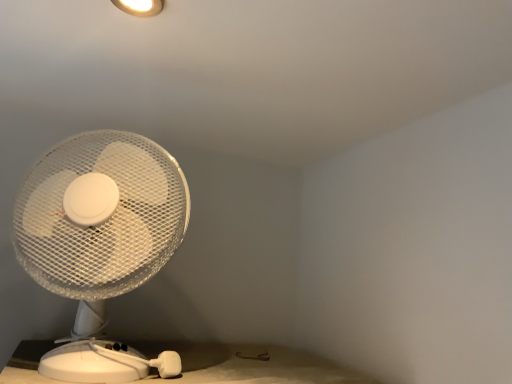
Describe the element at coordinates (100, 241) in the screenshot. I see `white plastic fan at left` at that location.

In order to face white plastic fan at left, should I rotate leftwards or rightwards?

You should look left and rotate roughly 19.495 degrees.

Find the location of a particular element. The width and height of the screenshot is (512, 384). white plastic fan at left is located at coordinates (100, 241).

Image resolution: width=512 pixels, height=384 pixels. I want to click on white plastic fan at left, so coord(100,241).